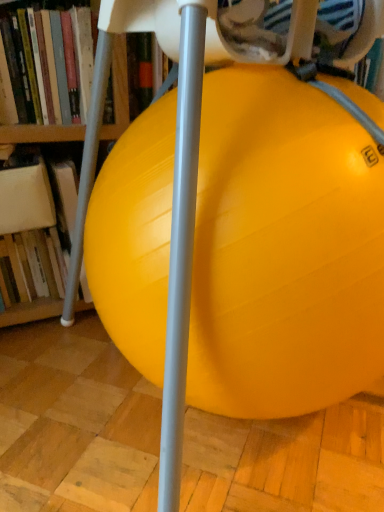
Question: Is hardcover book at left, positioned as the 1th book in bottom-to-top order, facing away from yellow rubber ball at center?

Choices:
 (A) yes
 (B) no

Answer: (B)

Question: From a real-world perspective, is hardcover book at left, positioned as the 1th book in bottom-to-top order, over yellow rubber ball at center?

Choices:
 (A) no
 (B) yes

Answer: (A)

Question: Could you tell me if hardcover book at left, positioned as the 1th book in bottom-to-top order, is facing yellow rubber ball at center?

Choices:
 (A) no
 (B) yes

Answer: (A)

Question: Can you confirm if hardcover book at left, positioned as the 2th book in top-to-bottom order, is wider than yellow rubber ball at center?

Choices:
 (A) yes
 (B) no

Answer: (B)

Question: From a real-world perspective, does hardcover book at left, positioned as the 2th book in top-to-bottom order, sit lower than yellow rubber ball at center?

Choices:
 (A) yes
 (B) no

Answer: (A)

Question: Relative to yellow rubber ball at center, is hardcover book at left, which ranks as the 2th book in bottom-to-top order, in front or behind?

Choices:
 (A) behind
 (B) front

Answer: (A)

Question: Considering the positions of point (26, 105) and point (150, 356), is point (26, 105) closer or farther from the camera than point (150, 356)?

Choices:
 (A) farther
 (B) closer

Answer: (A)

Question: Visually, is hardcover book at left, which is the first book from top to bottom, positioned to the left or to the right of yellow rubber ball at center?

Choices:
 (A) right
 (B) left

Answer: (B)

Question: Is hardcover book at left, which ranks as the 2th book in bottom-to-top order, situated inside yellow rubber ball at center or outside?

Choices:
 (A) outside
 (B) inside

Answer: (A)

Question: Choose the correct answer: Is yellow rubber ball at center inside hardcover book at left, which is the first book from top to bottom, or outside it?

Choices:
 (A) inside
 (B) outside

Answer: (B)

Question: Is point (312, 256) closer or farther from the camera than point (109, 119)?

Choices:
 (A) closer
 (B) farther

Answer: (A)

Question: From their relative heights in the image, would you say yellow rubber ball at center is taller or shorter than hardcover book at left, which is the first book from top to bottom?

Choices:
 (A) short
 (B) tall

Answer: (B)

Question: Considering the positions of yellow rubber ball at center and hardcover book at left, which is the first book from top to bottom, in the image, is yellow rubber ball at center wider or thinner than hardcover book at left, which is the first book from top to bottom,?

Choices:
 (A) wide
 (B) thin

Answer: (A)

Question: Looking at their shapes, would you say yellow rubber ball at center is wider or thinner than hardcover book at left, positioned as the 1th book in bottom-to-top order?

Choices:
 (A) thin
 (B) wide

Answer: (B)

Question: Considering their positions, is yellow rubber ball at center located in front of or behind hardcover book at left, positioned as the 2th book in top-to-bottom order?

Choices:
 (A) front
 (B) behind

Answer: (A)